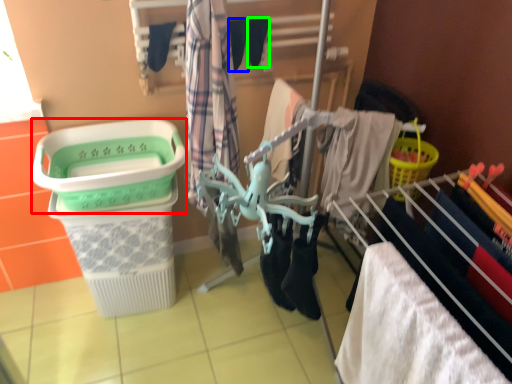
Question: Considering the real-world distances, which object is farthest from basket container (highlighted by a red box)? shoe (highlighted by a blue box) or shoe (highlighted by a green box)?

Choices:
 (A) shoe
 (B) shoe

Answer: (B)